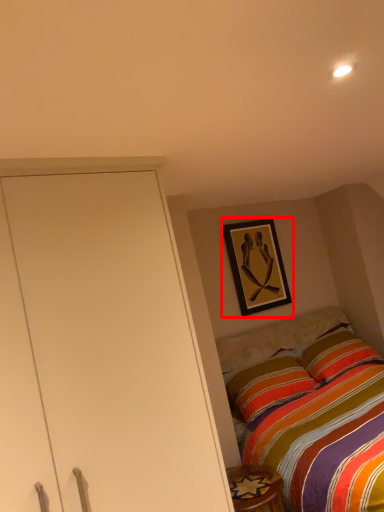
Question: From the image's perspective, where is picture frame (annotated by the red box) located relative to furniture?

Choices:
 (A) above
 (B) below

Answer: (A)